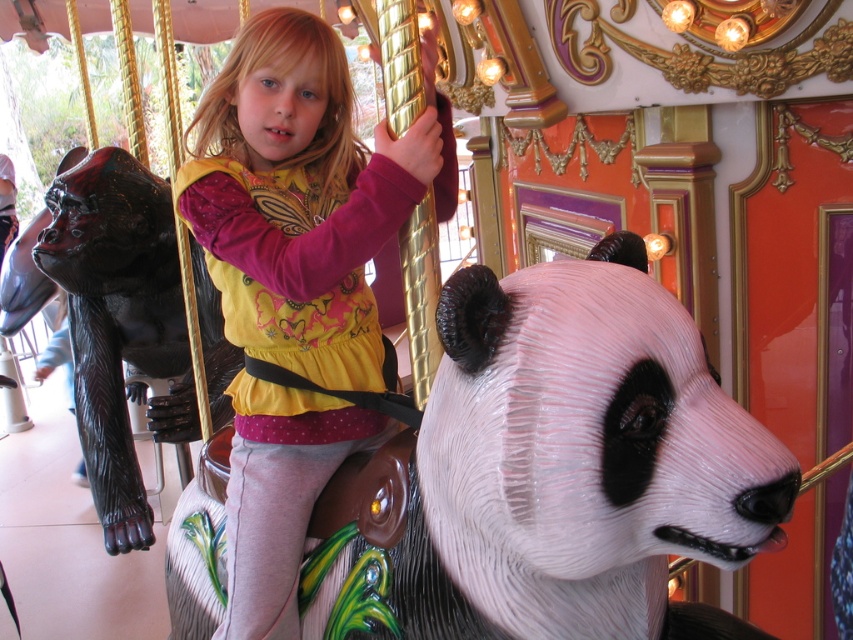
Question: Does white glossy panda head at center appear on the left side of matte yellow shirt at center?

Choices:
 (A) yes
 (B) no

Answer: (B)

Question: Can you confirm if white glossy panda head at center is smaller than matte yellow shirt at center?

Choices:
 (A) no
 (B) yes

Answer: (B)

Question: Can you confirm if white glossy panda head at center is smaller than matte yellow shirt at center?

Choices:
 (A) no
 (B) yes

Answer: (B)

Question: Among these objects, which one is farthest from the camera?

Choices:
 (A) matte yellow shirt at center
 (B) white glossy panda head at center

Answer: (A)

Question: Which point is farther to the camera?

Choices:
 (A) (341, 154)
 (B) (421, 560)

Answer: (A)